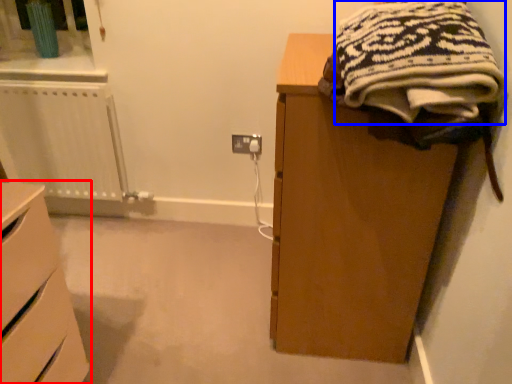
Question: Which of the following is the closest to the observer, chest of drawers (highlighted by a red box) or clothing (highlighted by a blue box)?

Choices:
 (A) chest of drawers
 (B) clothing

Answer: (B)